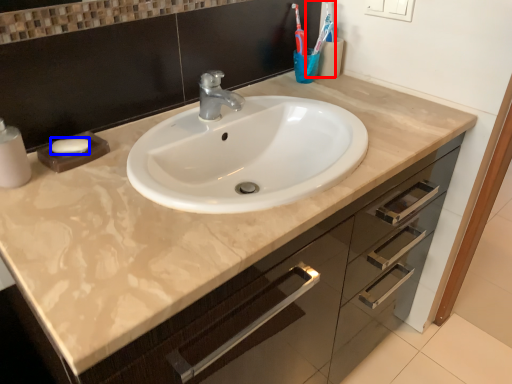
Question: Which point is further to the camera, toothbrush (highlighted by a red box) or soap (highlighted by a blue box)?

Choices:
 (A) toothbrush
 (B) soap

Answer: (A)